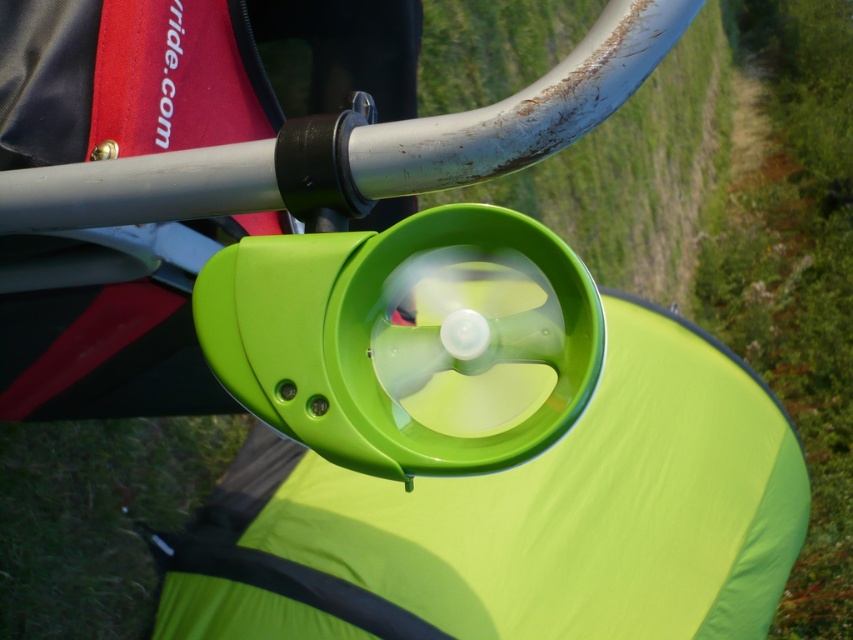
In the scene shown: Does green matte grass at upper center appear on the left side of green grass at lower left?

No, green matte grass at upper center is not to the left of green grass at lower left.

Between green matte grass at upper center and green grass at lower left, which one appears on the right side from the viewer's perspective?

green matte grass at upper center

Between point (663, 157) and point (30, 588), which one is positioned behind?

Positioned behind is point (663, 157).

In order to click on green matte grass at upper center in this screenshot , I will do `click(634, 172)`.